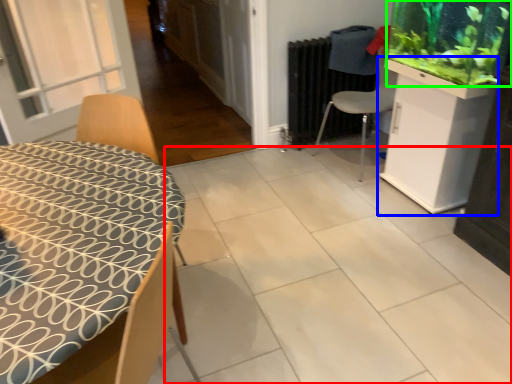
Question: Which is nearer to the tile (highlighted by a red box)? cabinetry (highlighted by a blue box) or plant (highlighted by a green box).

Choices:
 (A) cabinetry
 (B) plant

Answer: (A)